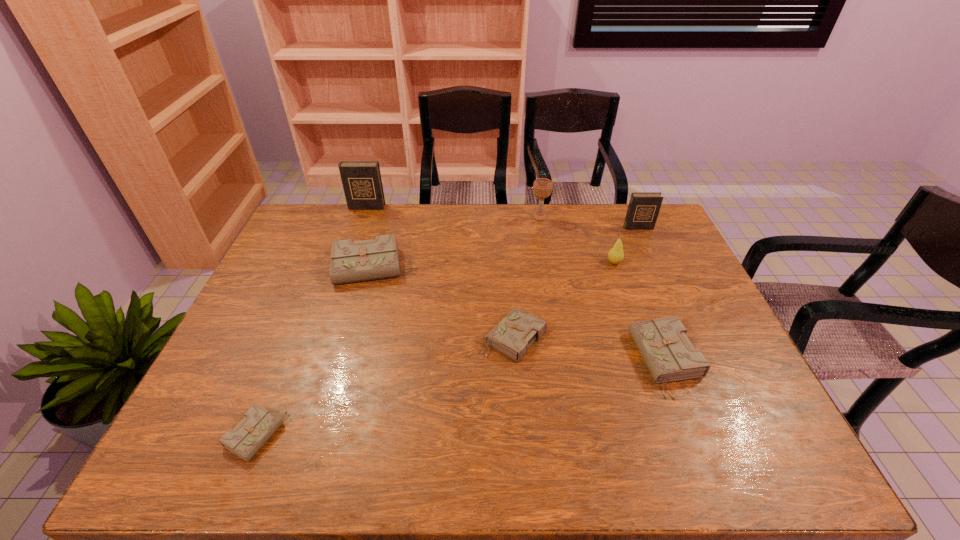
Identify the location of the rightmost green diary. This screenshot has width=960, height=540. (663, 344).

The image size is (960, 540). I want to click on the seventh tallest object, so click(x=512, y=336).

You are a GUI agent. You are given a task and a screenshot of the screen. Output one action in this format:
    pyautogui.click(x=<x>, y=<y>)
    Task: Click on the second smallest green diary
    The height and width of the screenshot is (540, 960).
    Given the screenshot: What is the action you would take?
    pyautogui.click(x=512, y=336)

The image size is (960, 540). I want to click on the shortest diary, so click(x=251, y=433).

Find the location of a particular element. The width and height of the screenshot is (960, 540). the nearest green diary is located at coordinates (251, 433).

You are a GUI agent. You are given a task and a screenshot of the screen. Output one action in this format:
    pyautogui.click(x=<x>, y=<y>)
    Task: Click on the vacant position located 0.220m on the front cover of the left dark diary
    The height and width of the screenshot is (540, 960).
    Given the screenshot: What is the action you would take?
    pyautogui.click(x=353, y=246)

This screenshot has height=540, width=960. What are the coordinates of `vacant area situated 0.190m on the front of the fifth object from left to right` in the screenshot? It's located at (546, 256).

The width and height of the screenshot is (960, 540). I want to click on vacant space situated on the front cover of the second farthest diary, so click(665, 288).

Find the location of a particular element. This screenshot has height=540, width=960. vacant position located on the front of the fourth tallest object is located at coordinates (629, 306).

At what (x,y) coordinates should I click in order to perform the action: click on free space located 0.140m on the left of the fifth tallest object. Please return your answer as a coordinate pair (x, y). This screenshot has height=540, width=960. Looking at the image, I should click on pyautogui.click(x=288, y=267).